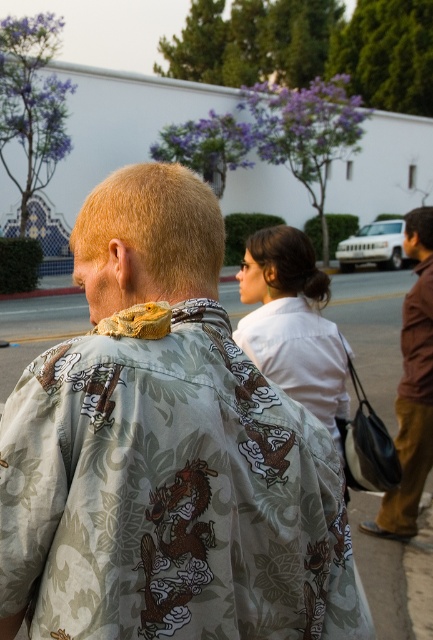
Question: Does white cotton shirt at center lie behind brown leather bag at right?

Choices:
 (A) no
 (B) yes

Answer: (A)

Question: Which object appears farthest from the camera in this image?

Choices:
 (A) printed fabric shirt at center
 (B) white cotton shirt at center

Answer: (B)

Question: Which point appears closest to the camera in this image?

Choices:
 (A) [x=383, y=532]
 (B) [x=135, y=236]

Answer: (B)

Question: From the image, what is the correct spatial relationship of white cotton shirt at center in relation to brown leather bag at right?

Choices:
 (A) left
 (B) right

Answer: (A)

Question: Which point appears closest to the camera in this image?

Choices:
 (A) (328, 600)
 (B) (401, 332)
 (C) (320, 371)

Answer: (A)

Question: Does white cotton shirt at center have a larger size compared to brown leather bag at right?

Choices:
 (A) yes
 (B) no

Answer: (B)